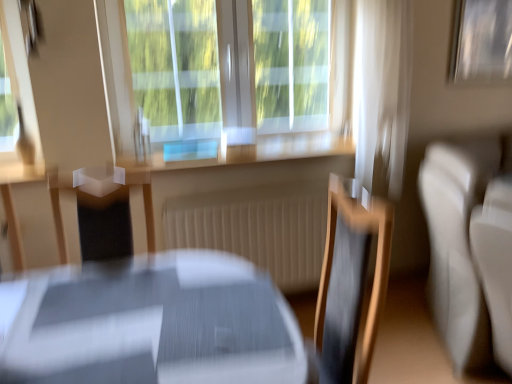
Question: Is white sheer curtain at upper right not within metallic silver picture frame at upper left, acting as the second picture frame starting from the back?

Choices:
 (A) no
 (B) yes

Answer: (B)

Question: From a real-world perspective, is white sheer curtain at upper right positioned over metallic silver picture frame at upper left, acting as the second picture frame starting from the back, based on gravity?

Choices:
 (A) no
 (B) yes

Answer: (A)

Question: Can you confirm if white sheer curtain at upper right is positioned to the left of metallic silver picture frame at upper left, arranged as the first picture frame when viewed from the left?

Choices:
 (A) no
 (B) yes

Answer: (A)

Question: Does white sheer curtain at upper right have a greater width compared to metallic silver picture frame at upper left, acting as the second picture frame starting from the back?

Choices:
 (A) yes
 (B) no

Answer: (A)

Question: Is white sheer curtain at upper right aimed at metallic silver picture frame at upper left, marked as the 1th picture frame in a front-to-back arrangement?

Choices:
 (A) yes
 (B) no

Answer: (B)

Question: Does white sheer curtain at upper right have a smaller size compared to metallic silver picture frame at upper left, arranged as the first picture frame when viewed from the left?

Choices:
 (A) no
 (B) yes

Answer: (A)

Question: Is white sheer curtain at upper right behind white leather couch at right?

Choices:
 (A) yes
 (B) no

Answer: (A)

Question: Can you confirm if white sheer curtain at upper right is bigger than white leather couch at right?

Choices:
 (A) yes
 (B) no

Answer: (B)

Question: From a real-world perspective, is white sheer curtain at upper right located higher than white leather couch at right?

Choices:
 (A) yes
 (B) no

Answer: (A)

Question: Is white sheer curtain at upper right positioned far away from white leather couch at right?

Choices:
 (A) yes
 (B) no

Answer: (B)

Question: Is white sheer curtain at upper right wider than white leather couch at right?

Choices:
 (A) no
 (B) yes

Answer: (A)

Question: Is white leather couch at right surrounded by white sheer curtain at upper right?

Choices:
 (A) yes
 (B) no

Answer: (B)

Question: Can you see white sheer curtain at upper right touching transparent glass window at center?

Choices:
 (A) no
 (B) yes

Answer: (A)